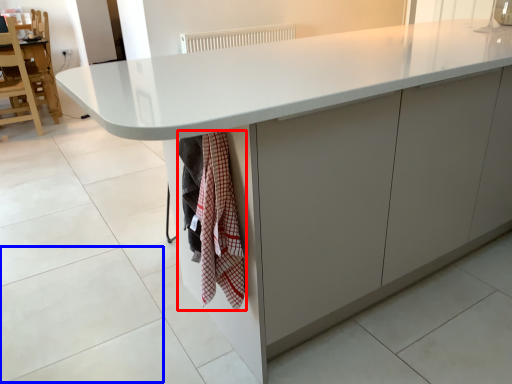
Question: Which of the following is the closest to the observer, blanket (highlighted by a red box) or granite (highlighted by a blue box)?

Choices:
 (A) blanket
 (B) granite

Answer: (A)